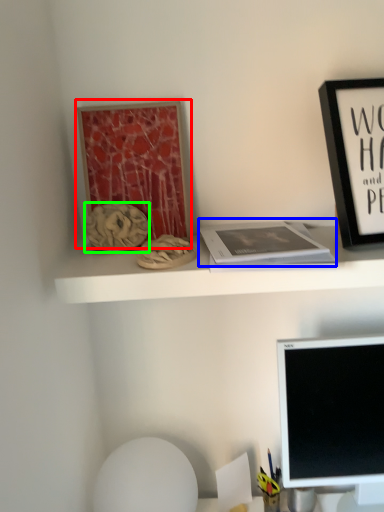
Question: Which object is the farthest from bulletin board (highlighted by a red box)? Choose among these: paperback book (highlighted by a blue box) or art (highlighted by a green box).

Choices:
 (A) paperback book
 (B) art

Answer: (A)